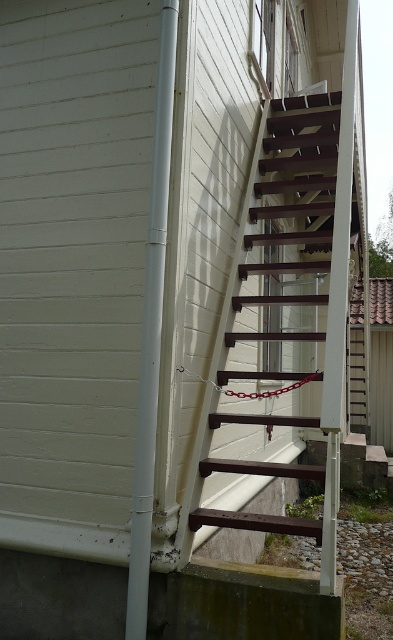
Question: Which of the following is the closest to the observer?

Choices:
 (A) brown wooden ladder at center
 (B) white plastic pole at left

Answer: (B)

Question: Which point is closer to the camera?

Choices:
 (A) (308, 525)
 (B) (139, 456)

Answer: (A)

Question: Is brown wooden ladder at center to the left of white plastic pole at left from the viewer's perspective?

Choices:
 (A) yes
 (B) no

Answer: (B)

Question: Can you confirm if brown wooden ladder at center is smaller than white plastic pole at left?

Choices:
 (A) no
 (B) yes

Answer: (B)

Question: Is the position of brown wooden ladder at center more distant than that of white plastic pole at left?

Choices:
 (A) no
 (B) yes

Answer: (B)